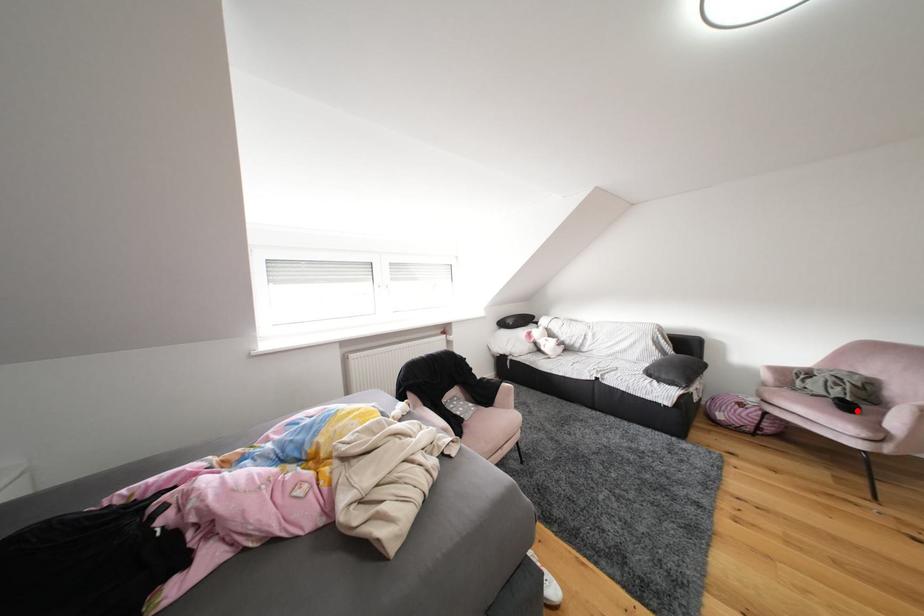
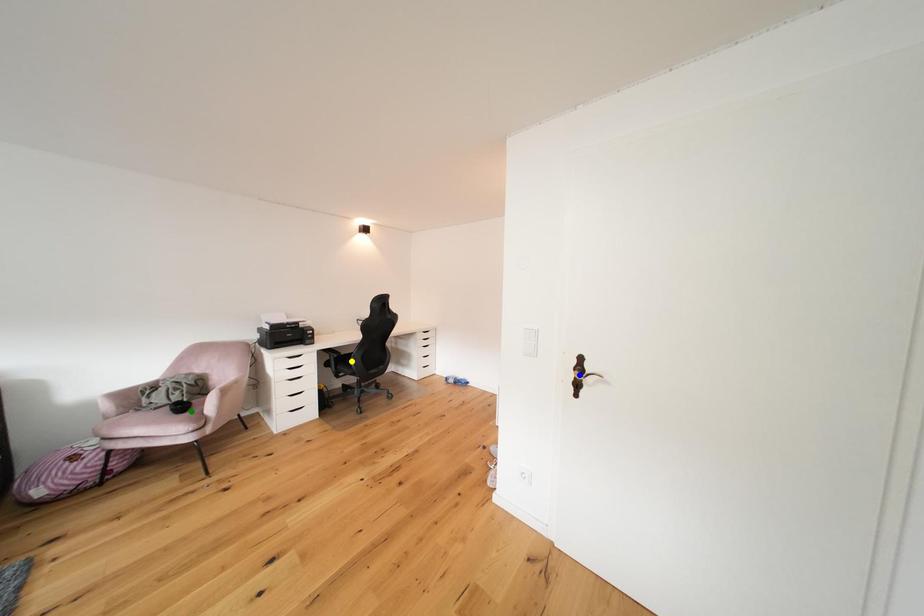
Question: I am providing you with two images of the same scene from different viewpoints. A red point is marked on the first image. You are given multiple points on the second image. Which mark in image 2 goes with the point in image 1?

Choices:
 (A) blue point
 (B) green point
 (C) yellow point

Answer: (B)